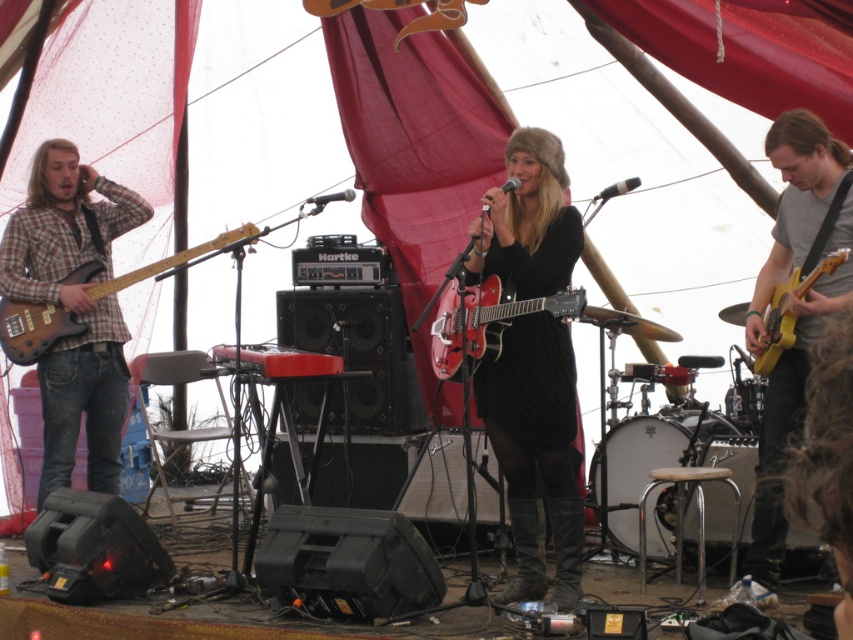
Question: Considering the real-world distances, which object is closest to the brown plaid shirt at left?

Choices:
 (A) wooden electric guitar at left
 (B) shiny red electric guitar at center
 (C) yellow matte electric guitar at right
 (D) matte yellow guitar at right

Answer: (A)

Question: Which point is closer to the camera?

Choices:
 (A) (784, 205)
 (B) (76, 161)

Answer: (A)

Question: Can you confirm if shiny red electric guitar at center is positioned below yellow matte electric guitar at right?

Choices:
 (A) yes
 (B) no

Answer: (A)

Question: Where is brown plaid shirt at left located in relation to yellow matte electric guitar at right in the image?

Choices:
 (A) below
 (B) above

Answer: (A)

Question: Is black fur hat at center positioned behind yellow matte electric guitar at right?

Choices:
 (A) yes
 (B) no

Answer: (A)

Question: Which point is farther to the camera?

Choices:
 (A) wooden electric guitar at left
 (B) shiny red electric guitar at center
 (C) black fur hat at center
 (D) brown plaid shirt at left

Answer: (D)